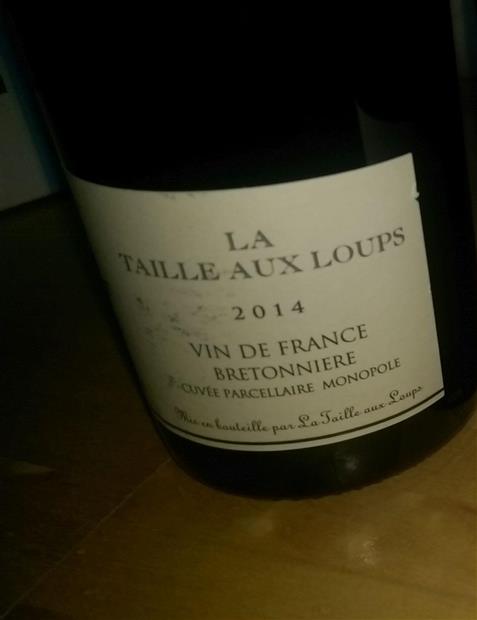
Image resolution: width=477 pixels, height=620 pixels. In order to click on wine bottle above label in this screenshot , I will do `click(234, 102)`.